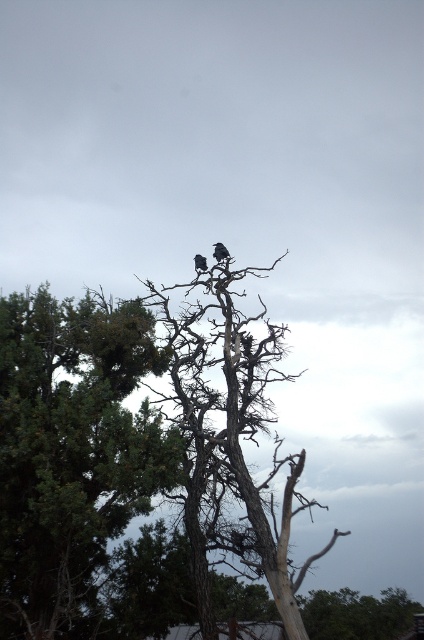
You are standing at the origin point of the image. Where is the dead wood tree at center located in terms of coordinates?

The dead wood tree at center is located at coordinates point (231, 435).

Consider the image. You are standing at the origin point in the image. There are two points marked as point 1 at coordinates (x=161, y=369) and point 2 at (x=201, y=260). Which point is closer to you?

Point 2 at coordinates (x=201, y=260) is closer to you because it is in front of point 1 at coordinates (x=161, y=369).